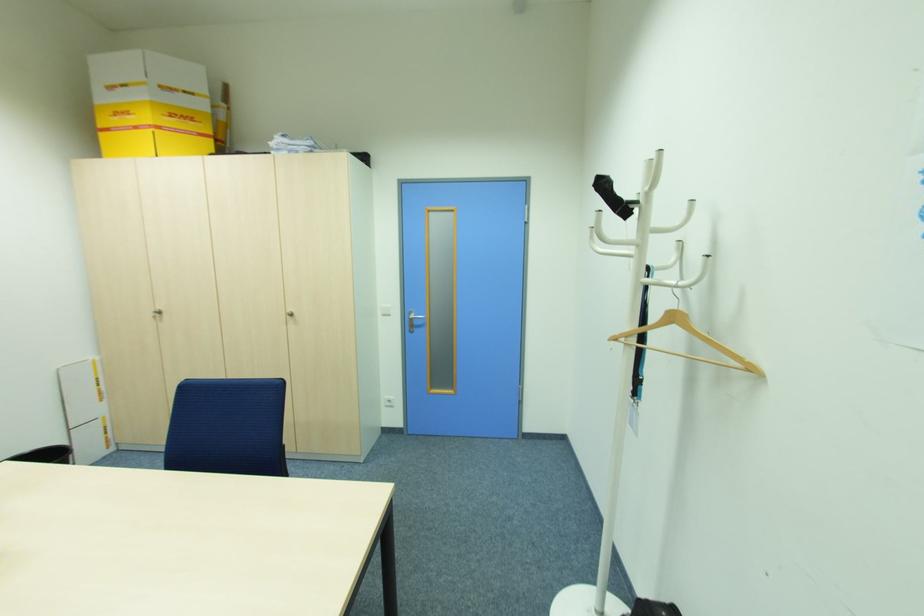
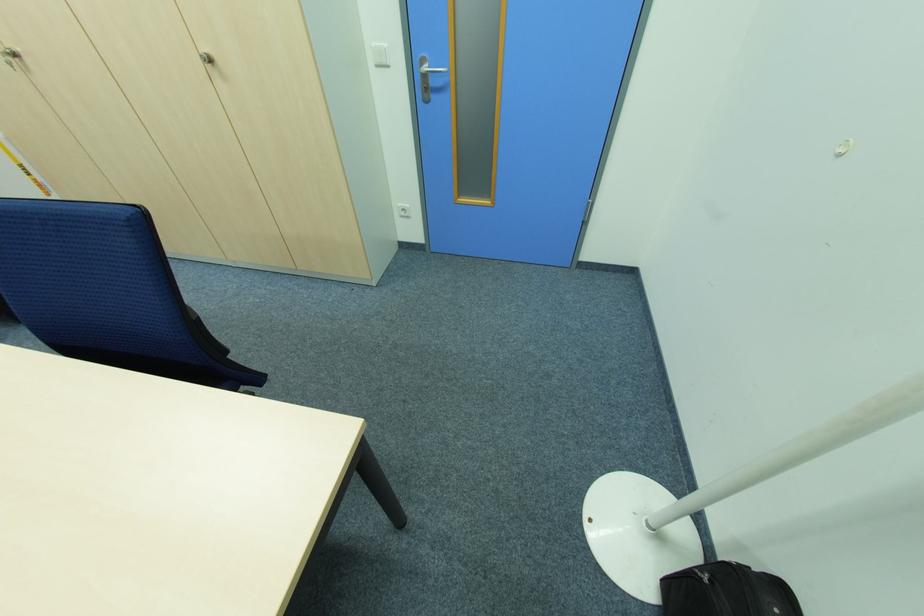
Locate, in the second image, the point that corresponds to point (294, 314) in the first image.

(213, 62)